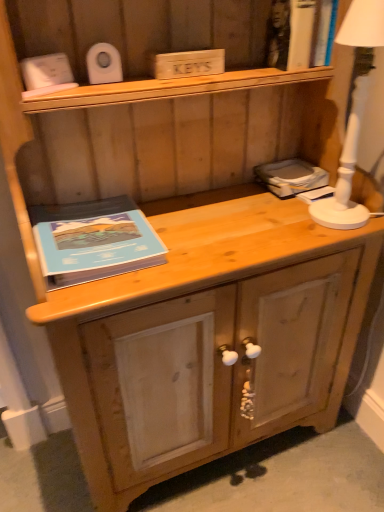
Question: Considering their positions, is natural wood drawer at lower center located in front of or behind white ceramic lamp at right?

Choices:
 (A) front
 (B) behind

Answer: (B)

Question: Is natural wood drawer at lower center to the left or to the right of white ceramic lamp at right in the image?

Choices:
 (A) left
 (B) right

Answer: (A)

Question: Which is farther from the matte gray book at right?

Choices:
 (A) blue matte book at left
 (B) natural wood drawer at lower center
 (C) white ceramic lamp at right

Answer: (A)

Question: Which of these objects is positioned closest to the blue matte book at left?

Choices:
 (A) natural wood drawer at lower center
 (B) matte gray book at right
 (C) white ceramic lamp at right

Answer: (A)